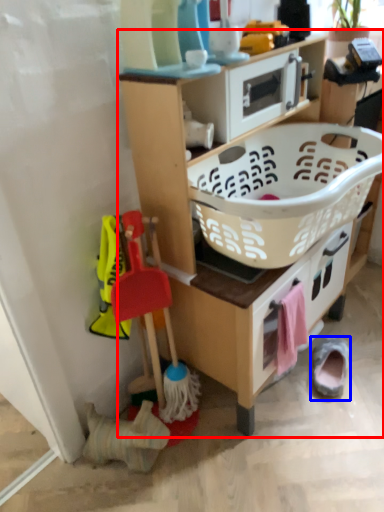
Question: Which object appears farthest to the camera in this image, shelf (highlighted by a red box) or footwear (highlighted by a blue box)?

Choices:
 (A) shelf
 (B) footwear

Answer: (B)